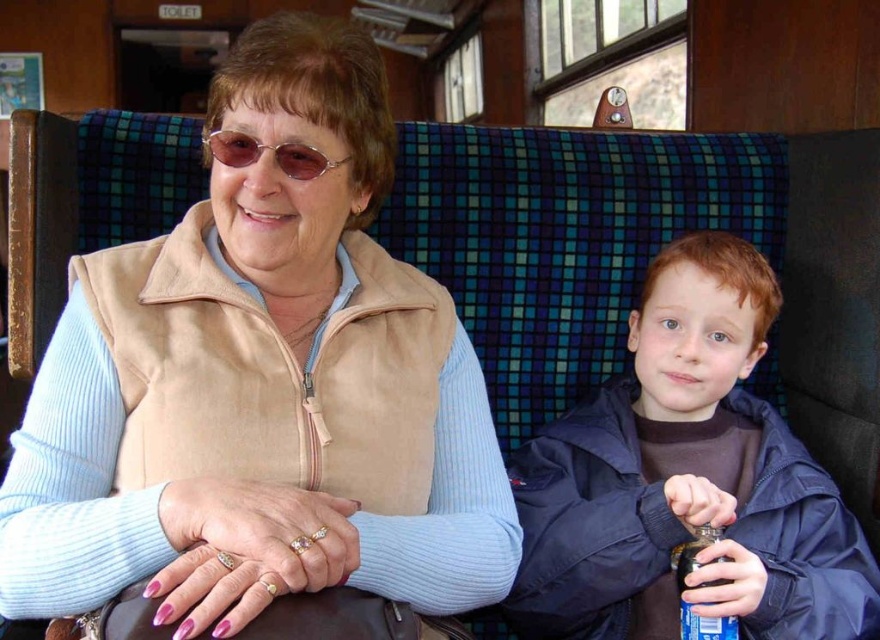
Question: Is matte beige vest at center below dark blue jacket at right?

Choices:
 (A) no
 (B) yes

Answer: (A)

Question: Which object is positioned farthest from the dark glass bottle at lower right?

Choices:
 (A) matte beige vest at center
 (B) dark blue jacket at right
 (C) sunglasses at center

Answer: (C)

Question: Can you confirm if dark blue jacket at right is thinner than sunglasses at center?

Choices:
 (A) no
 (B) yes

Answer: (A)

Question: Among these objects, which one is nearest to the camera?

Choices:
 (A) dark blue jacket at right
 (B) sunglasses at center
 (C) matte beige vest at center

Answer: (C)

Question: Which object appears closest to the camera in this image?

Choices:
 (A) dark glass bottle at lower right
 (B) dark blue jacket at right

Answer: (B)

Question: Can you confirm if matte beige vest at center is bigger than dark blue jacket at right?

Choices:
 (A) no
 (B) yes

Answer: (B)